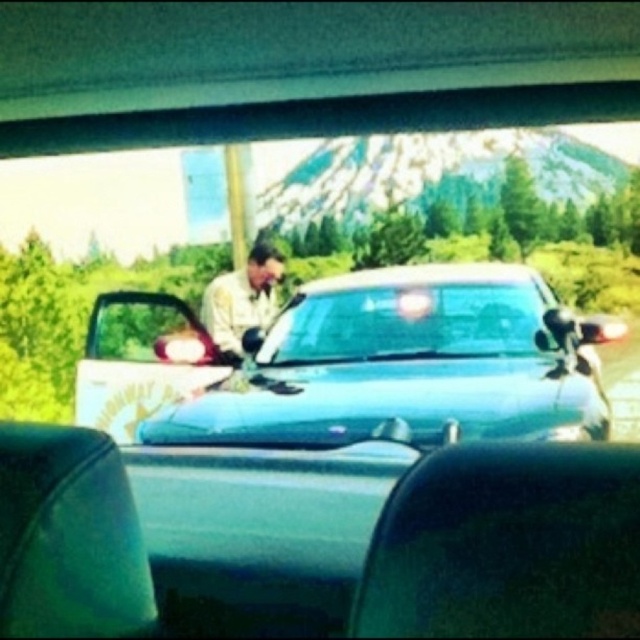
You are driving and need to check if the matte khaki uniform at center is visible through the transparent glass windshield at center. Can you see it?

The matte khaki uniform at center is closer to the viewer than the transparent glass windshield at center, so yes, the uniform is visible through the windshield.

You are driving a car and notice a person in a matte khaki uniform at center near the transparent glass windshield at center. Can you safely open your car door without hitting the person?

The matte khaki uniform at center is 7.60 inches away from the transparent glass windshield at center. Since the distance is very close, opening the door might risk hitting the person, so it is not safe to do so.

You are a passenger in the car and want to determine which uniform is wider between the matte khaki uniform at center and the light beige uniform at center. Which one is wider?

The matte khaki uniform at center is wider than the light beige uniform at center according to the description.